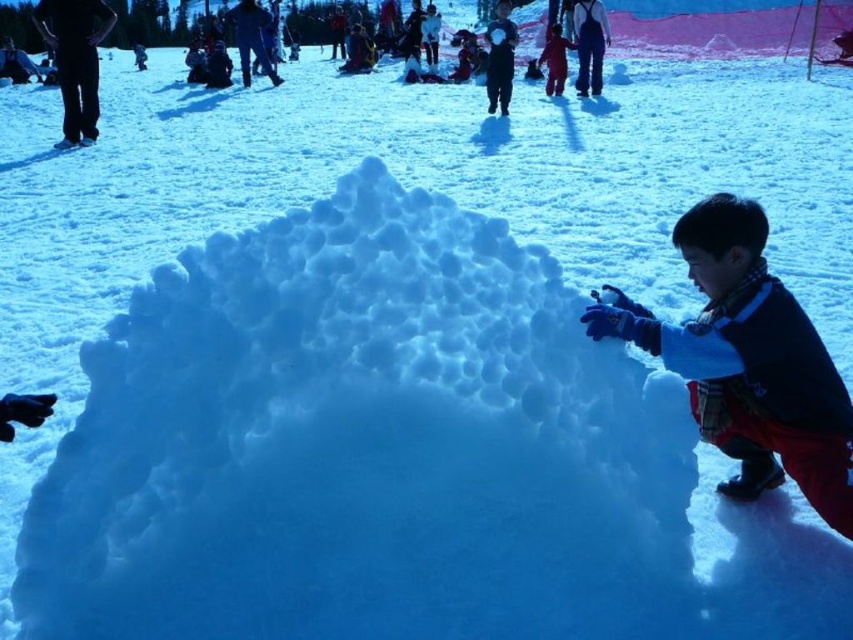
You are standing at the location of the viewer in the winter scene. There is a black pants at upper left. Can you safely walk towards it without needing to move any snow sculptures or other obstacles?

The black pants at upper left is 8.70 meters away from the viewer, so yes, you can walk towards it without needing to move any snow sculptures or other obstacles as there is enough space between them.

You are standing at the point labeled as point (74, 60) in the winter scene. What object is directly beneath your feet?

The point labeled as point (74, 60) is on black pants at upper left, so the object directly beneath your feet is the black pants at upper left.

You notice two items of clothing in the winter scene. The dark blue wool scarf at lower right and the dark blue snowsuit at upper right. Which one is positioned more to the left?

The dark blue wool scarf at lower right is positioned to the left of the dark blue snowsuit at upper right.